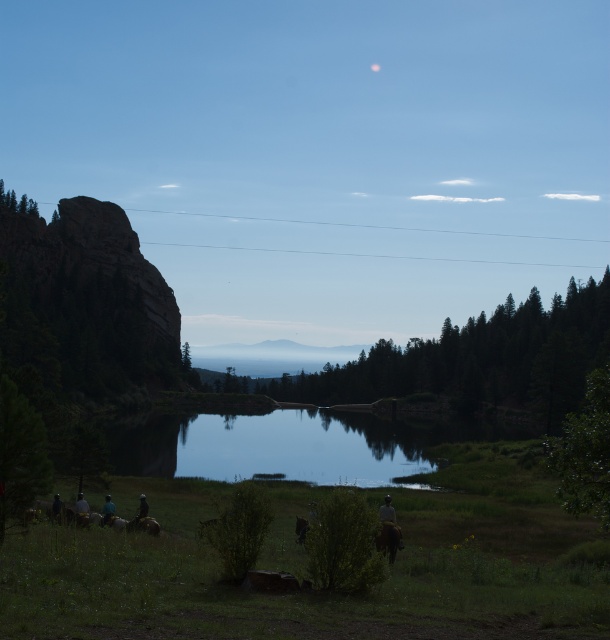
You are an artist trying to sketch the scene. You notice the green leafy bush at center and the green fabric shirt at lower left. Which object should you draw first if you want to follow the rule of drawing smaller objects before larger ones?

The green leafy bush at center should be drawn first because it has a smaller size compared to the green fabric shirt at lower left.

In the scene shown: You are standing in the scene and see the green leafy bush at center and the green fabric shirt at lower left. Which object is positioned to the right of the other?

The green leafy bush at center is to the right of the green fabric shirt at lower left.

You are standing in the grassy area and want to walk towards the green matte tree at center. However, there is another green matte tree at lower left in your path. Which tree will you encounter first?

You will first encounter the green matte tree at lower left because it is closer to you than the green matte tree at center.